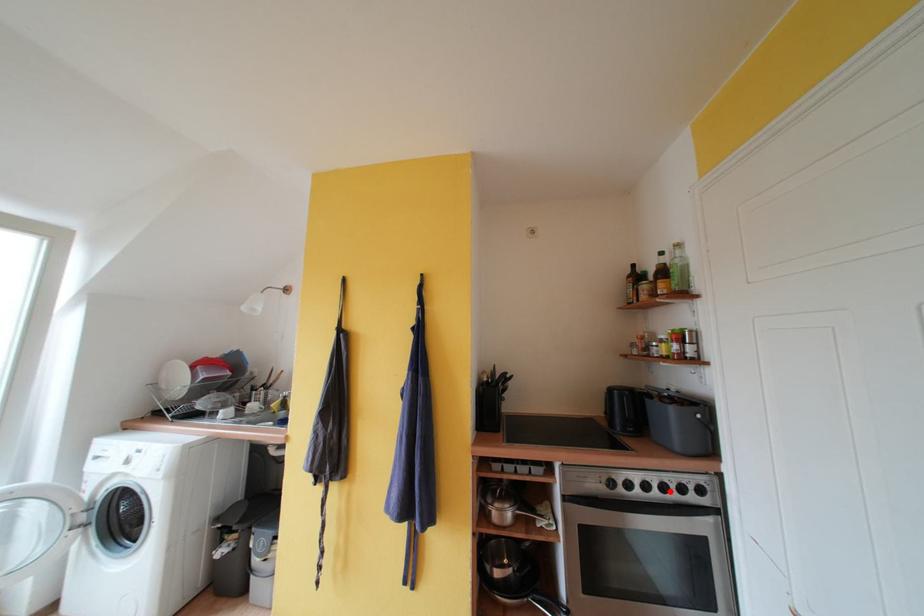
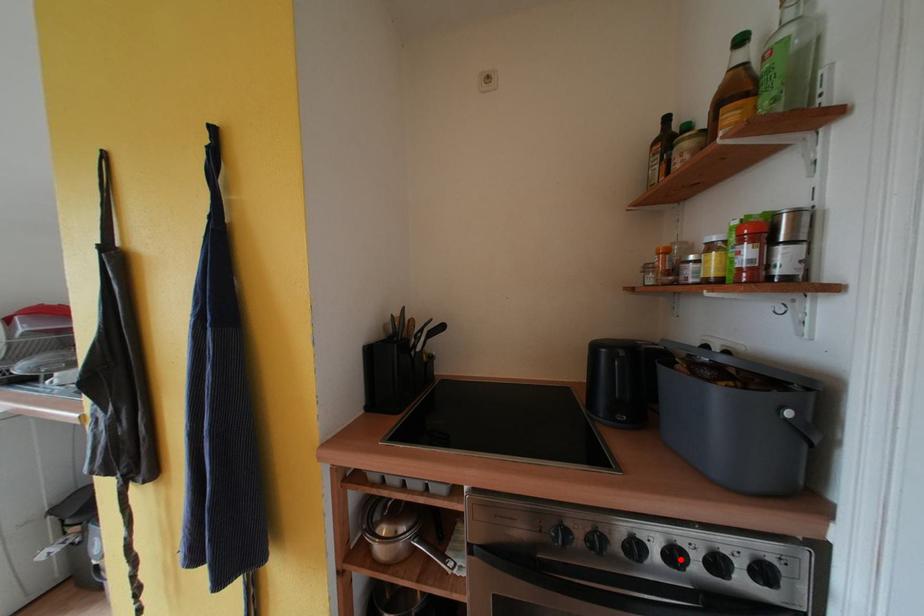
I am providing you with two images of the same scene from different viewpoints. A red point is marked on the first image and another point is marked on the second image. Do the highlighted points in image1 and image2 indicate the same real-world spot?

Yes